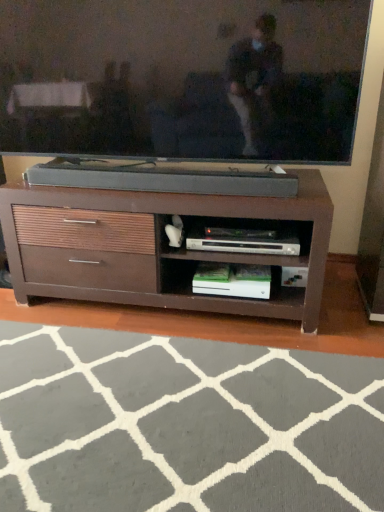
This screenshot has height=512, width=384. What do you see at coordinates (153, 247) in the screenshot?
I see `brown wood chest of drawers at center` at bounding box center [153, 247].

Locate an element on the screen. gray soft rug at lower center is located at coordinates (184, 424).

Which of these two, matte black tv at upper center or gray soft rug at lower center, is wider?

gray soft rug at lower center.

Does matte black tv at upper center turn towards gray soft rug at lower center?

No, matte black tv at upper center does not turn towards gray soft rug at lower center.

Which is behind, point (34, 73) or point (103, 510)?

The point (34, 73) is farther from the camera.

The width and height of the screenshot is (384, 512). I want to click on plain directly beneath the brown wood chest of drawers at center (from a real-world perspective), so click(184, 424).

Does brown wood chest of drawers at center have a lesser height compared to gray soft rug at lower center?

In fact, brown wood chest of drawers at center may be taller than gray soft rug at lower center.

Considering the sizes of brown wood chest of drawers at center and gray soft rug at lower center in the image, is brown wood chest of drawers at center wider or thinner than gray soft rug at lower center?

Clearly, brown wood chest of drawers at center has less width compared to gray soft rug at lower center.

From the image's perspective, between brown wood chest of drawers at center and gray soft rug at lower center, which one is located above?

brown wood chest of drawers at center appears higher in the image.

Would you consider matte black tv at upper center to be distant from brown wood chest of drawers at center?

No, matte black tv at upper center is not far from brown wood chest of drawers at center.

Can you confirm if matte black tv at upper center is thinner than brown wood chest of drawers at center?

Yes, matte black tv at upper center is thinner than brown wood chest of drawers at center.

Does point (98, 138) come behind point (56, 292)?

That is False.

Is matte black tv at upper center to the left or to the right of brown wood chest of drawers at center in the image?

Clearly, matte black tv at upper center is on the left of brown wood chest of drawers at center in the image.

From the picture: Between brown wood chest of drawers at center and matte black tv at upper center, which one is positioned behind?

brown wood chest of drawers at center is further away from the camera.

Is brown wood chest of drawers at center smaller than matte black tv at upper center?

Incorrect, brown wood chest of drawers at center is not smaller in size than matte black tv at upper center.

Consider the image. Between brown wood chest of drawers at center and matte black tv at upper center, which one has more height?

With more height is matte black tv at upper center.

Does gray soft rug at lower center contain brown wood chest of drawers at center?

Definitely not — brown wood chest of drawers at center is not inside gray soft rug at lower center.

From the picture: Considering the positions of objects gray soft rug at lower center and brown wood chest of drawers at center in the image provided, who is in front, gray soft rug at lower center or brown wood chest of drawers at center?

gray soft rug at lower center.

Is gray soft rug at lower center oriented away from brown wood chest of drawers at center?

No, gray soft rug at lower center is not facing the opposite direction of brown wood chest of drawers at center.

Is gray soft rug at lower center taller than matte black tv at upper center?

No, gray soft rug at lower center is not taller than matte black tv at upper center.

From the image's perspective, is gray soft rug at lower center located above or below matte black tv at upper center?

Based on their image positions, gray soft rug at lower center is located beneath matte black tv at upper center.

Is gray soft rug at lower center turned away from matte black tv at upper center?

No, matte black tv at upper center is not at the back of gray soft rug at lower center.

At what (x,y) coordinates should I click in order to perform the action: click on plain below the matte black tv at upper center (from a real-world perspective). Please return your answer as a coordinate pair (x, y). Image resolution: width=384 pixels, height=512 pixels. Looking at the image, I should click on (184, 424).

You are a GUI agent. You are given a task and a screenshot of the screen. Output one action in this format:
    pyautogui.click(x=<x>, y=<y>)
    Task: Click on the plain that is on the left side of brown wood chest of drawers at center
    The width and height of the screenshot is (384, 512).
    Given the screenshot: What is the action you would take?
    pyautogui.click(x=184, y=424)

Estimate the real-world distances between objects in this image. Which object is further from gray soft rug at lower center, matte black tv at upper center or brown wood chest of drawers at center?

Among the two, matte black tv at upper center is located further to gray soft rug at lower center.

Which object lies nearer to the anchor point brown wood chest of drawers at center, matte black tv at upper center or gray soft rug at lower center?

Based on the image, matte black tv at upper center appears to be nearer to brown wood chest of drawers at center.

Based on their spatial positions, is gray soft rug at lower center or matte black tv at upper center closer to brown wood chest of drawers at center?

The object closer to brown wood chest of drawers at center is matte black tv at upper center.

When comparing their distances from gray soft rug at lower center, does brown wood chest of drawers at center or matte black tv at upper center seem closer?

brown wood chest of drawers at center is positioned closer to the anchor gray soft rug at lower center.

Which object lies nearer to the anchor point matte black tv at upper center, brown wood chest of drawers at center or gray soft rug at lower center?

brown wood chest of drawers at center.

From the image, which object appears to be farther from matte black tv at upper center, gray soft rug at lower center or brown wood chest of drawers at center?

gray soft rug at lower center lies further to matte black tv at upper center than the other object.

Where is `the chest of drawers between matte black tv at upper center and gray soft rug at lower center vertically`? The width and height of the screenshot is (384, 512). the chest of drawers between matte black tv at upper center and gray soft rug at lower center vertically is located at coordinates (153, 247).